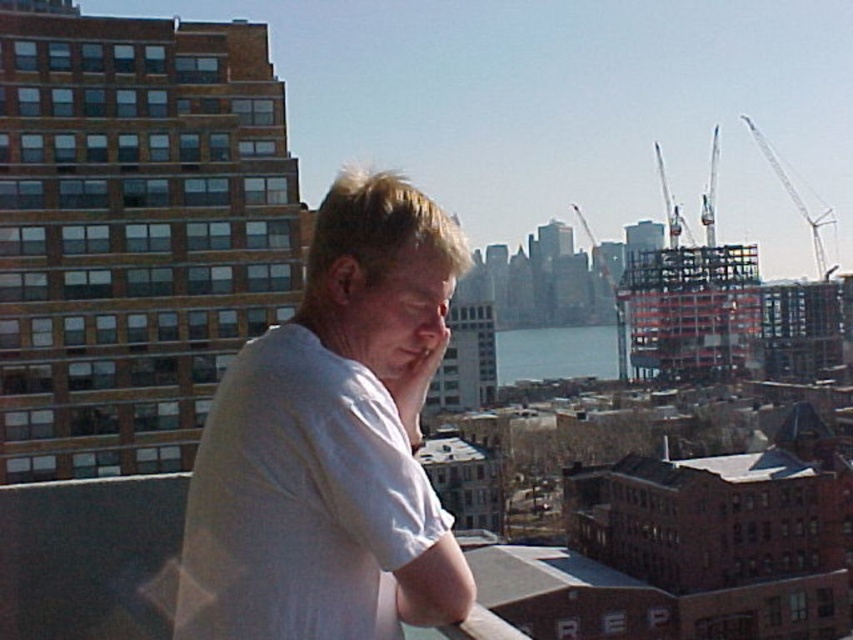
Can you confirm if white cotton shirt at center is shorter than white metallic crane at upper right?

Yes, white cotton shirt at center is shorter than white metallic crane at upper right.

Does point (463, 268) lie behind point (791, 180)?

No, it is in front of (791, 180).

Which is behind, point (184, 612) or point (805, 209)?

The point (805, 209) is more distant.

Identify the location of white cotton shirt at center. (331, 442).